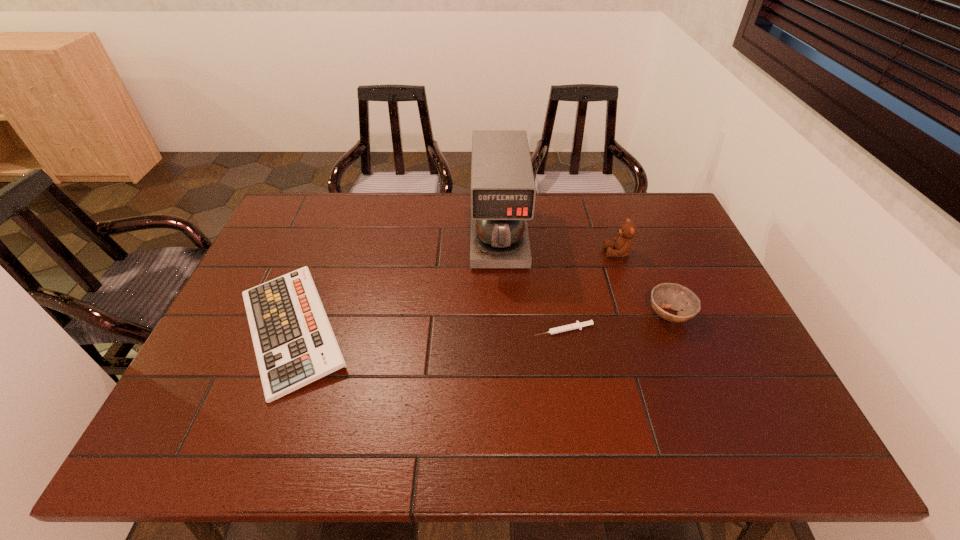
The image size is (960, 540). Identify the location of vacant area between the second shortest object and the coffee maker. (396, 282).

Point out which object is positioned as the fourth nearest to the third shortest object. Please provide its 2D coordinates. Your answer should be formatted as a tuple, i.e. [(x, y)], where the tuple contains the x and y coordinates of a point satisfying the conditions above.

[(294, 343)]

Select which object appears as the third closest to the teddy bear. Please provide its 2D coordinates. Your answer should be formatted as a tuple, i.e. [(x, y)], where the tuple contains the x and y coordinates of a point satisfying the conditions above.

[(577, 325)]

Identify the location of free space that satisfies the following two spatial constraints: 1. on the face of the teddy bear; 2. on the left side of the third shortest object. Image resolution: width=960 pixels, height=540 pixels. (639, 314).

Locate an element on the screen. This screenshot has width=960, height=540. vacant space that satisfies the following two spatial constraints: 1. on the face of the second tallest object; 2. on the front side of the fourth tallest object is located at coordinates (644, 330).

Where is `vacant space that satisfies the following two spatial constraints: 1. on the face of the second tallest object; 2. on the left side of the third shortest object`? The width and height of the screenshot is (960, 540). vacant space that satisfies the following two spatial constraints: 1. on the face of the second tallest object; 2. on the left side of the third shortest object is located at coordinates tap(639, 314).

The image size is (960, 540). Identify the location of free space that satisfies the following two spatial constraints: 1. on the face of the bowl; 2. on the right side of the teddy bear. point(639,314).